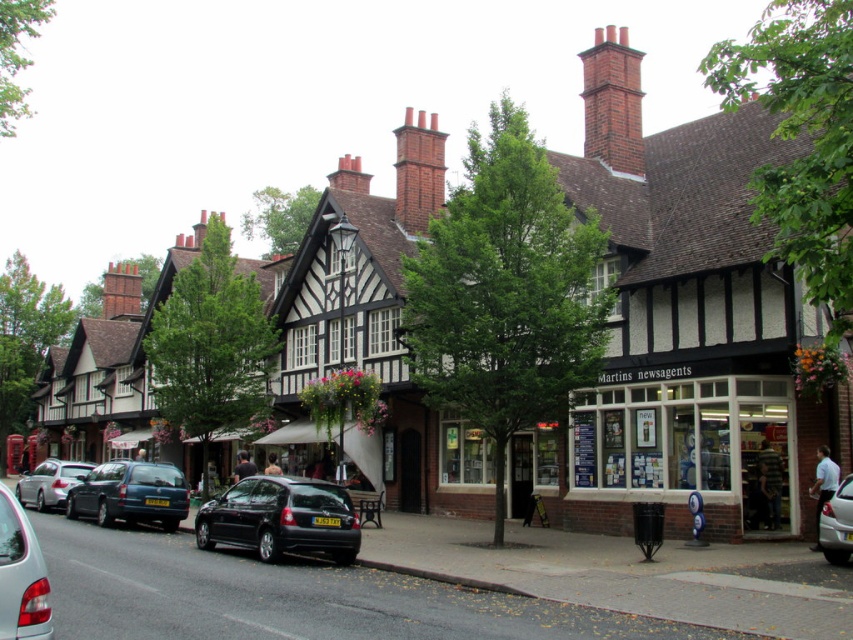
Does point (291, 538) come in front of point (78, 513)?

Yes, point (291, 538) is closer to viewer.

Measure the distance between shiny black hatchback at center and metallic blue car at center-left.

shiny black hatchback at center and metallic blue car at center-left are 8.58 meters apart.

Who is more forward, (320, 483) or (189, 502)?

Positioned in front is point (320, 483).

The width and height of the screenshot is (853, 640). Find the location of `shiny black hatchback at center`. shiny black hatchback at center is located at coordinates (281, 518).

How far apart are shiny black hatchback at center and matte black car at lower left?

shiny black hatchback at center is 19.73 meters away from matte black car at lower left.

Is point (309, 548) farther from viewer compared to point (3, 579)?

That is True.

Which is in front, point (291, 506) or point (24, 541)?

Point (24, 541) is in front.

Where is `shiny black hatchback at center`? This screenshot has width=853, height=640. shiny black hatchback at center is located at coordinates (281, 518).

Is white glass storefront at center positioned at the back of matte black car at lower left?

That is True.

Does white glass storefront at center have a lesser width compared to matte black car at lower left?

In fact, white glass storefront at center might be wider than matte black car at lower left.

Does point (791, 497) lie in front of point (50, 611)?

No, it is behind (50, 611).

Find the location of a particular element. This screenshot has width=853, height=640. white glass storefront at center is located at coordinates (688, 448).